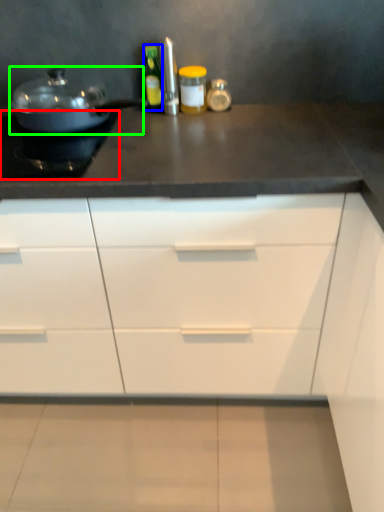
Question: Which object is the farthest from appliance (highlighted by a red box)? Choose among these: bottle (highlighted by a blue box) or kitchen appliance (highlighted by a green box).

Choices:
 (A) bottle
 (B) kitchen appliance

Answer: (A)